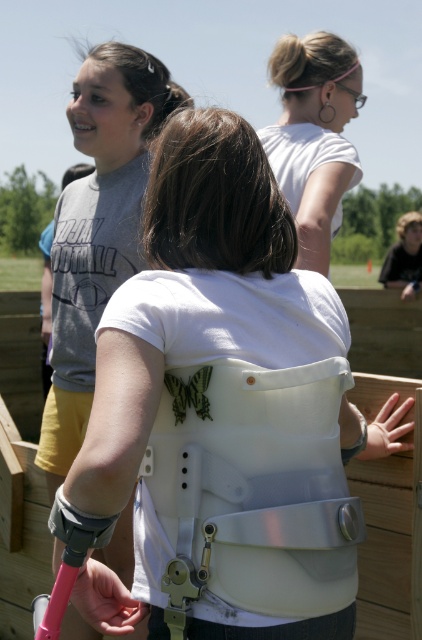
Between point (84, 150) and point (327, 170), which one is positioned behind?

Positioned behind is point (327, 170).

Who is shorter, white matte brace at center or white matte shirt at upper center?

white matte shirt at upper center

Does point (70, 410) come in front of point (308, 264)?

No, (70, 410) is behind (308, 264).

In order to click on white matte brace at center in this screenshot , I will do `click(97, 227)`.